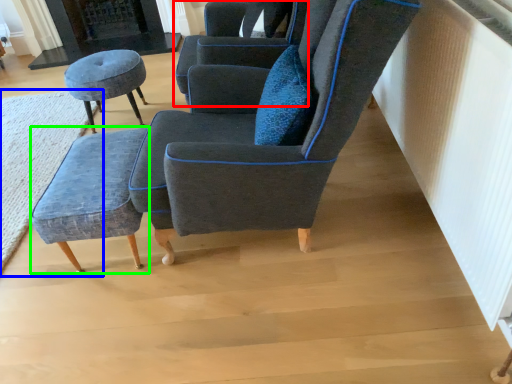
Question: Based on their relative distances, which object is nearer to chair (highlighted by a red box)? Choose from mat (highlighted by a blue box) and stool (highlighted by a green box).

Choices:
 (A) mat
 (B) stool

Answer: (B)